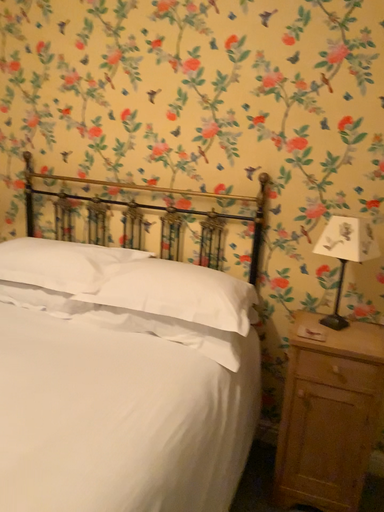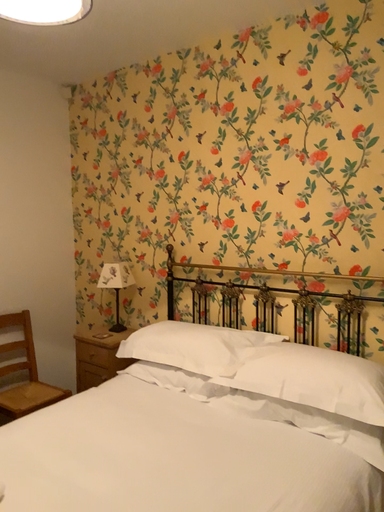
Question: How did the camera likely rotate when shooting the video?

Choices:
 (A) rotated left
 (B) rotated right

Answer: (A)